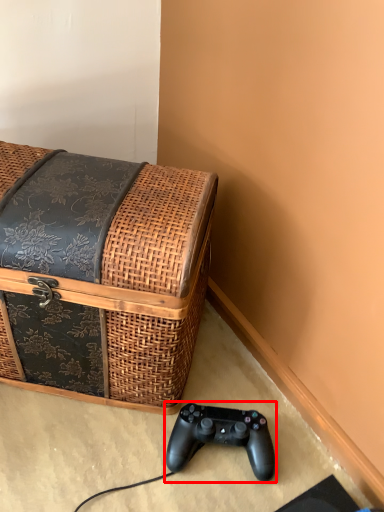
Question: From the image, what is the correct spatial relationship of game controller (annotated by the red box) in relation to furniture?

Choices:
 (A) right
 (B) left

Answer: (A)